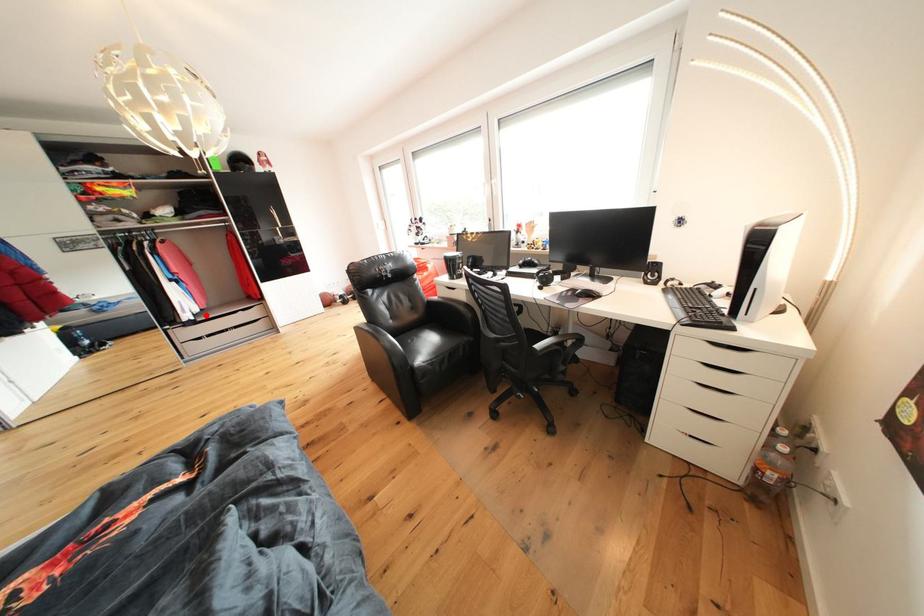
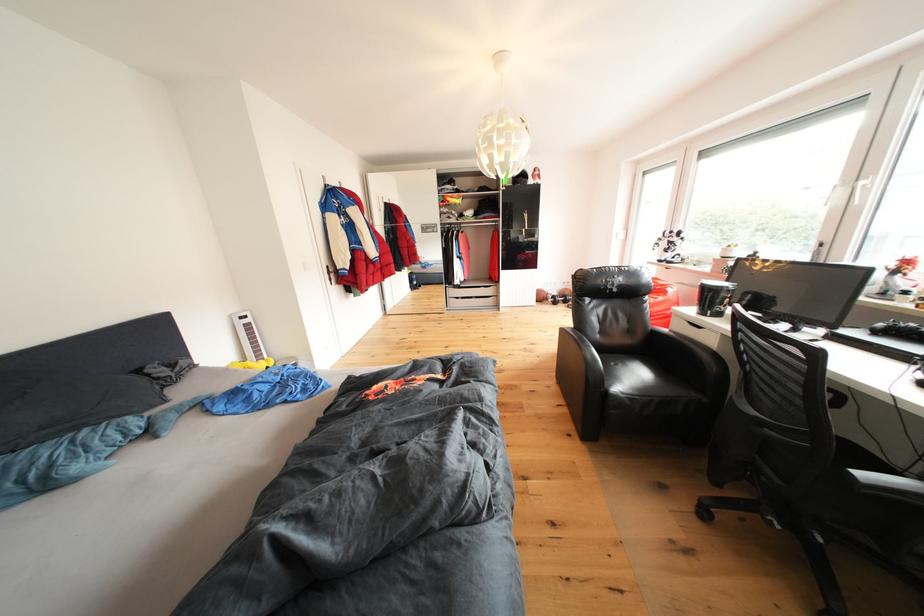
Question: I am providing you with two images of the same scene from different viewpoints. In image1, a red point is highlighted. Considering the same 3D point in image2, which of the following is correct?

Choices:
 (A) It is closer
 (B) It is farther

Answer: (A)